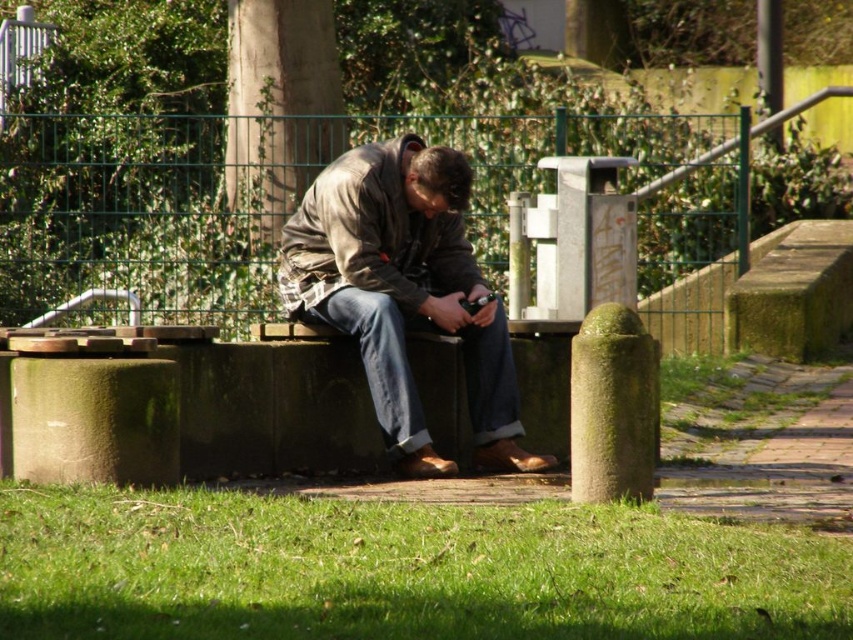
You are standing at the man sitting on the concrete bench in the park. You need to walk to a specific location. If you first walk to point (347, 189) and then to point (430, 232), will you be moving forward or backward relative to your original position?

Since point (347, 189) is in front of point (430, 232), moving from the man to point (347, 189) would be moving forward, and then moving to point (430, 232) would be moving backward relative to the original position.